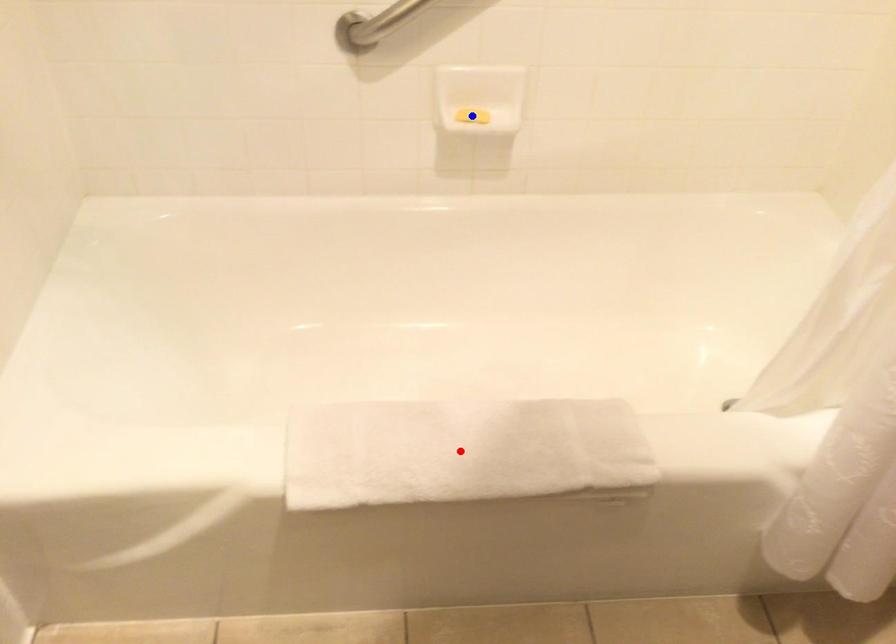
Question: Two points are marked on the image. Which point is closer to the camera?

Choices:
 (A) Blue point is closer.
 (B) Red point is closer.

Answer: (B)